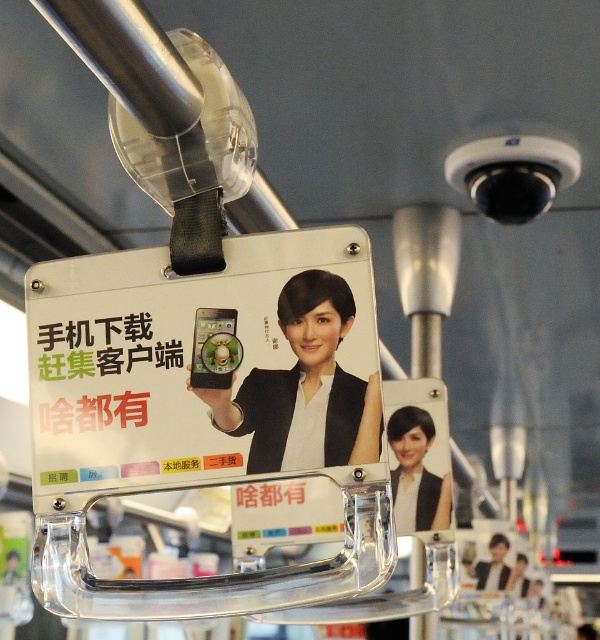
You are a commuter looking at the card holder with the matte black phone at center and the matte black jacket at center. Which object is placed higher in the image?

The matte black phone at center is positioned over the matte black jacket at center, so it is placed higher in the image.

You are a person with a 12 inch long scarf. You want to place it between the matte black phone at center and the matte black jacket at center. Will it fit without overlapping either object?

The distance between the matte black phone at center and the matte black jacket at center is 12.75 inches. Since the scarf is 12 inches long, it will fit between them without overlapping either object.

You are a designer reviewing a promotional ad for a new app. In the image, you see a matte black phone at center and a matte black jacket at center. Which object in the ad is bigger?

The matte black phone at center has a larger size compared to the matte black jacket at center, so the matte black phone at center is bigger.